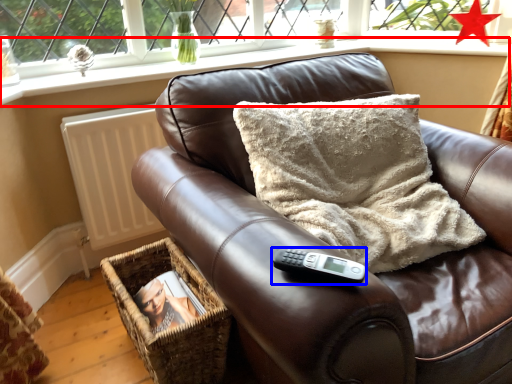
Question: Which object appears farthest to the camera in this image, window sill (highlighted by a red box) or remote (highlighted by a blue box)?

Choices:
 (A) window sill
 (B) remote

Answer: (A)